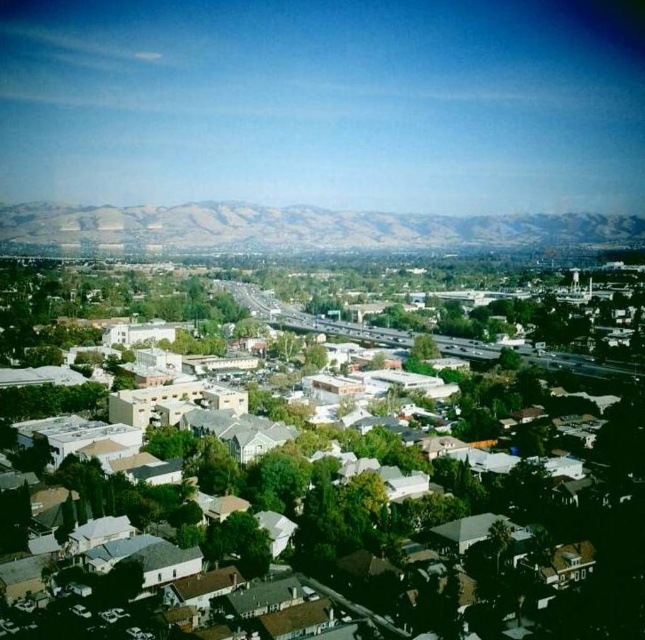
Does white matte houses at center have a larger size compared to brown textured mountains at upper center?

Indeed, white matte houses at center has a larger size compared to brown textured mountains at upper center.

Find the location of a particular element. The width and height of the screenshot is (645, 640). white matte houses at center is located at coordinates (453, 516).

You are a GUI agent. You are given a task and a screenshot of the screen. Output one action in this format:
    pyautogui.click(x=<x>, y=<y>)
    Task: Click on the white matte houses at center
    
    Given the screenshot: What is the action you would take?
    pyautogui.click(x=453, y=516)